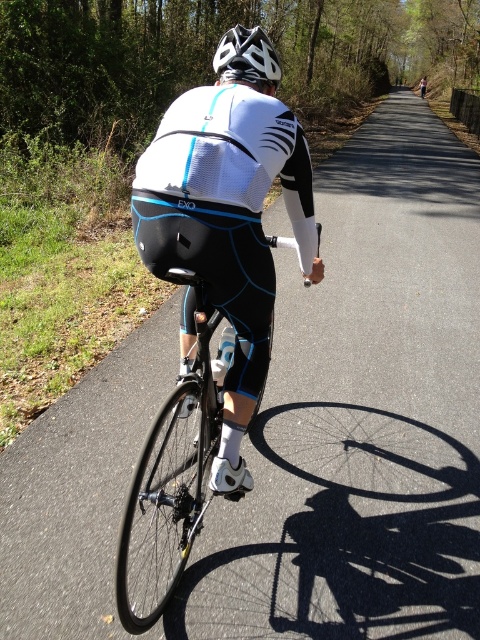
Is point (194, 284) closer to camera compared to point (273, 74)?

Yes.

Who is shorter, shiny black frame at center or white matte bicycle helmet at center?

Standing shorter between the two is white matte bicycle helmet at center.

Which is in front, point (216, 422) or point (239, 51)?

Point (239, 51) is more forward.

This screenshot has height=640, width=480. Identify the location of shiny black frame at center. (169, 481).